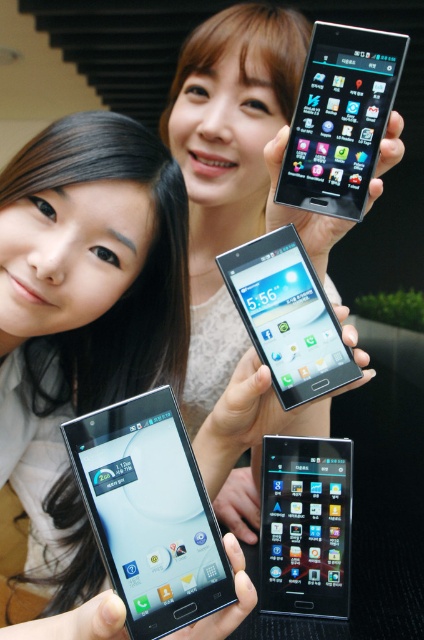
Can you confirm if matte black smartphone at lower left is taller than satin black smartphone at upper center?

No.

Does matte black smartphone at lower left appear over satin black smartphone at upper center?

No, matte black smartphone at lower left is not above satin black smartphone at upper center.

This screenshot has width=424, height=640. I want to click on matte black smartphone at lower left, so click(150, 513).

Does matte white phone at upper center have a lesser height compared to matte black smartphone at lower left?

Incorrect, matte white phone at upper center's height does not fall short of matte black smartphone at lower left's.

Which of these two, matte white phone at upper center or matte black smartphone at lower left, stands taller?

matte white phone at upper center is taller.

Describe the element at coordinates (236, 170) in the screenshot. I see `matte white phone at upper center` at that location.

Find the location of a particular element. This screenshot has width=424, height=640. matte white phone at upper center is located at coordinates (236, 170).

Is matte black smartphone at center to the right of satin black smartphone at center from the viewer's perspective?

Indeed, matte black smartphone at center is positioned on the right side of satin black smartphone at center.

Between point (286, 499) and point (303, 292), which one is positioned behind?

The point (286, 499) is more distant.

The image size is (424, 640). I want to click on matte black smartphone at center, so [x=306, y=525].